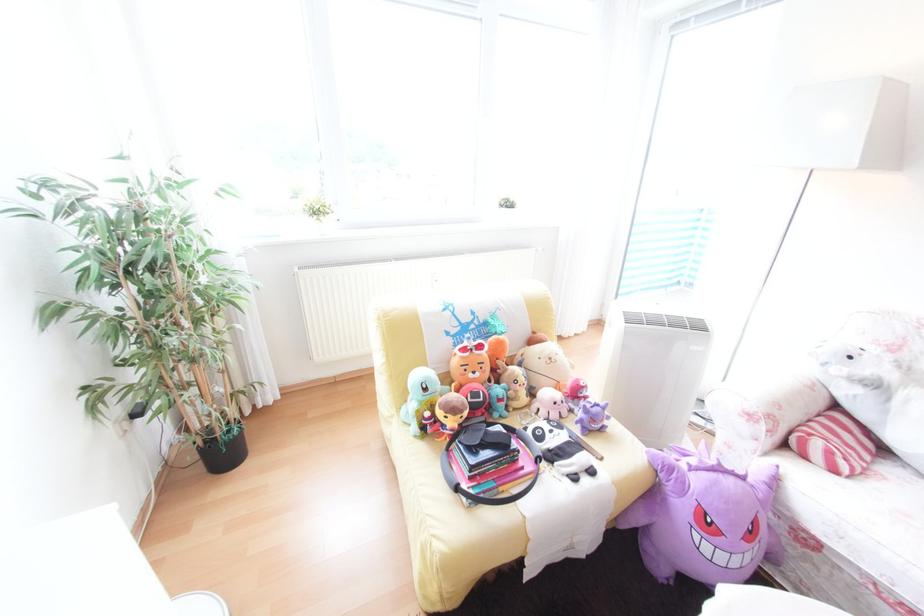
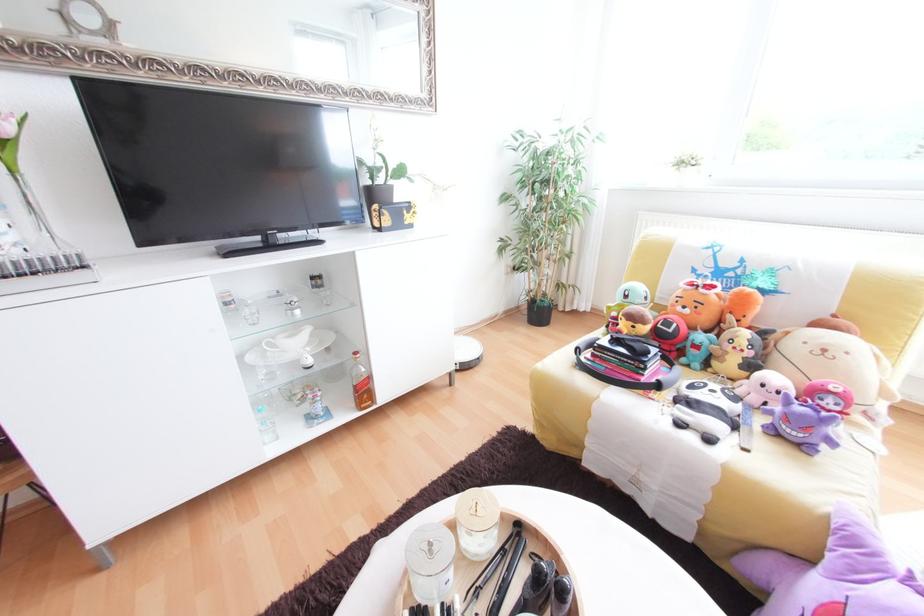
Where in the second image is the point corresponding to [476,408] from the first image?

(652, 323)